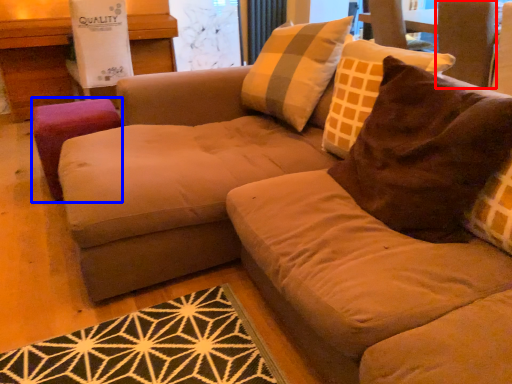
Question: Which object appears farthest to the camera in this image, swivel chair (highlighted by a red box) or stool (highlighted by a blue box)?

Choices:
 (A) swivel chair
 (B) stool

Answer: (A)